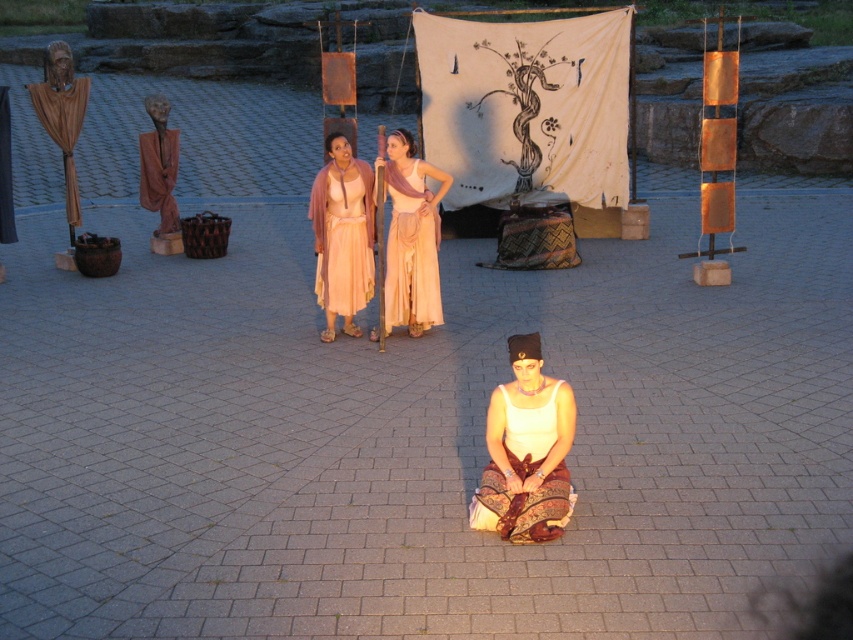
Which is behind, point (329, 257) or point (485, 528)?

Positioned behind is point (329, 257).

Looking at this image, does matte pink fabric at center have a lesser height compared to white cotton dress at center?

Incorrect, matte pink fabric at center's height does not fall short of white cotton dress at center's.

Identify the location of matte pink fabric at center. The image size is (853, 640). tap(341, 236).

At what (x,y) coordinates should I click in order to perform the action: click on matte pink fabric at center. Please return your answer as a coordinate pair (x, y). Looking at the image, I should click on (341, 236).

Is matte peach fabric dress at center smaller than brown matte robe at left?

Correct, matte peach fabric dress at center occupies less space than brown matte robe at left.

Between point (434, 308) and point (151, 195), which one is positioned behind?

The point (151, 195) is more distant.

Image resolution: width=853 pixels, height=640 pixels. In order to click on matte peach fabric dress at center in this screenshot , I will do `click(410, 252)`.

Can you confirm if matte peach fabric dress at center is thinner than matte brown robe at left?

Indeed, matte peach fabric dress at center has a lesser width compared to matte brown robe at left.

Does matte peach fabric dress at center appear over matte brown robe at left?

Incorrect, matte peach fabric dress at center is not positioned above matte brown robe at left.

Is point (409, 208) positioned in front of point (73, 214)?

Yes, point (409, 208) is in front of point (73, 214).

Where is `matte peach fabric dress at center`? matte peach fabric dress at center is located at coordinates (410, 252).